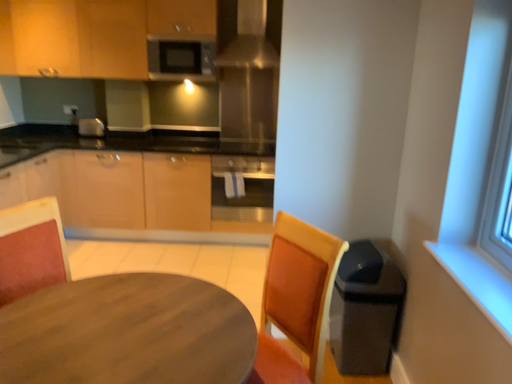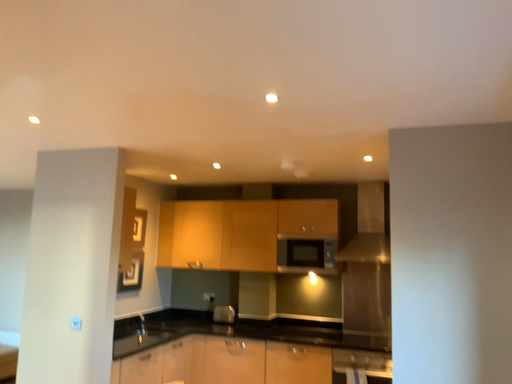
Question: How did the camera likely rotate when shooting the video?

Choices:
 (A) rotated right
 (B) rotated left

Answer: (B)